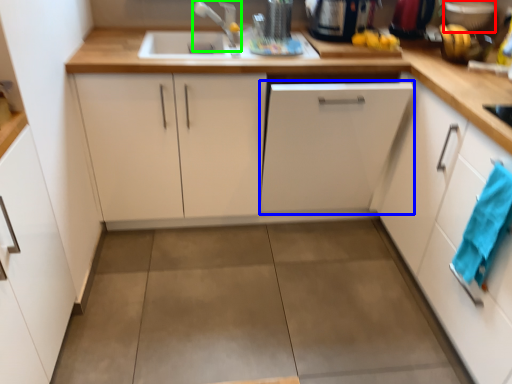
Question: Which object is the farthest from appliance (highlighted by a red box)? Choose among these: cabinetry (highlighted by a blue box) or faucet (highlighted by a green box).

Choices:
 (A) cabinetry
 (B) faucet

Answer: (B)